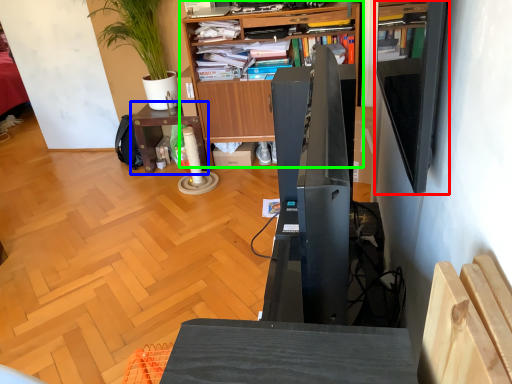
Question: Which is farther away from shelf (highlighted by a red box)? table (highlighted by a blue box) or bookcase (highlighted by a green box)?

Choices:
 (A) table
 (B) bookcase

Answer: (A)